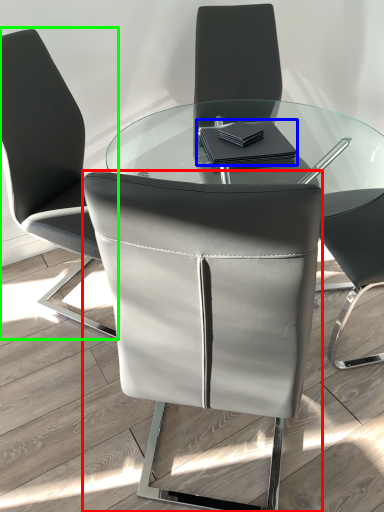
Question: Which is farther away from chair (highlighted by a red box)? notebook (highlighted by a blue box) or chair (highlighted by a green box)?

Choices:
 (A) notebook
 (B) chair

Answer: (B)